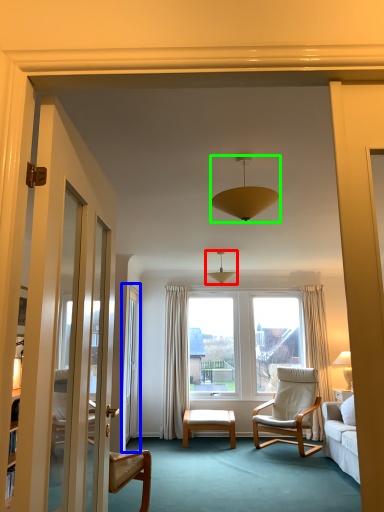
Question: Which object is positioned closest to light fixture (highlighted by a red box)? Select from screen door (highlighted by a blue box) and lamp (highlighted by a green box).

Choices:
 (A) screen door
 (B) lamp

Answer: (A)